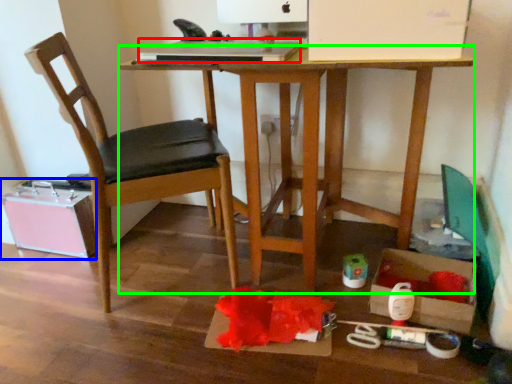
Question: Based on their relative distances, which object is nearer to laptop (highlighted by a red box)? Choose from storage box (highlighted by a blue box) and desk (highlighted by a green box).

Choices:
 (A) storage box
 (B) desk

Answer: (B)